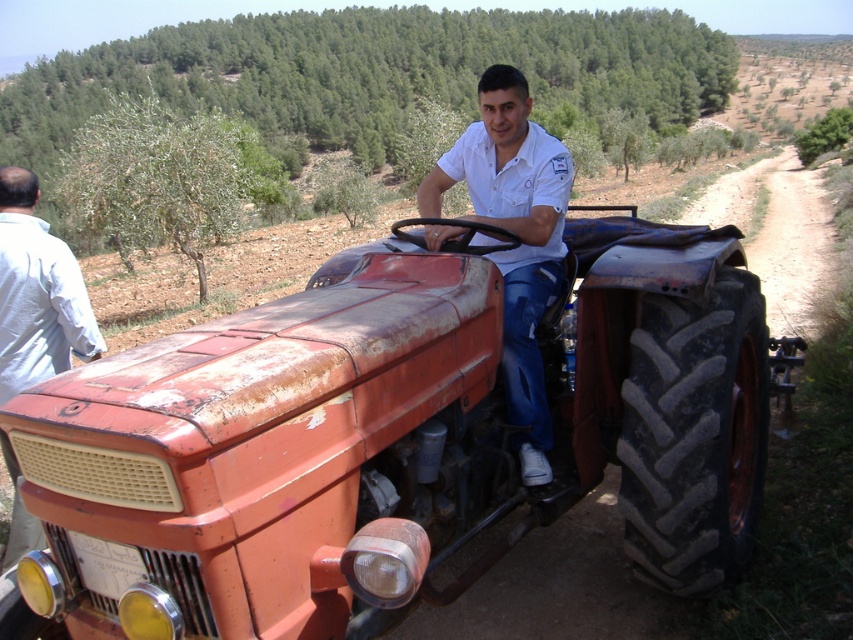
You are a farmer who needs to determine if your rusty metal tractor at center can fit through a narrow gate that is just wide enough for your light blue shirt at left. Based on their widths, can the tractor pass through the gate?

The rusty metal tractor at center is wider than the light blue shirt at left, so it cannot pass through the gate that fits the light blue shirt at left.

You are a photographer trying to capture a candid shot of the man in the white cotton shirt at center and the rusty metal tractor at center. Since you want to ensure both subjects are in focus, you need to know their relative positions. Which object is located to the left of the other?

The white cotton shirt at center is positioned to the left of the rusty metal tractor at center, as the tractor is on the right side of the shirt.